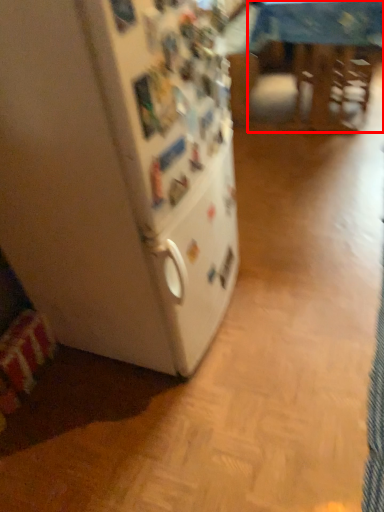
Question: From the image's perspective, where is table (annotated by the red box) located in relation to refrigerator in the image?

Choices:
 (A) below
 (B) above

Answer: (B)